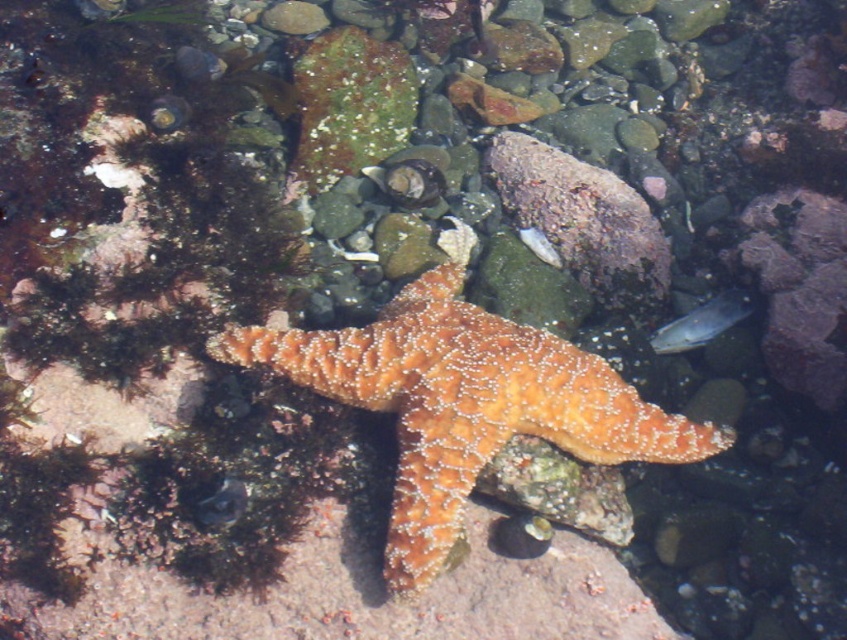
You are a marine biologist observing an underwater scene. You see the orange textured starfish at center. If you want to collect it using a 1.2 meter long tool, will you be able to reach it?

The orange textured starfish at center is 1.50 meters away from the viewer. Since the tool is only 1.2 meters long, it is not long enough to reach the starfish.

You are a marine biologist observing an underwater scene. You notice an orange textured starfish at center and a translucent plastic fish at center. Which object is bigger in size?

The orange textured starfish at center is larger in size compared to the translucent plastic fish at center.